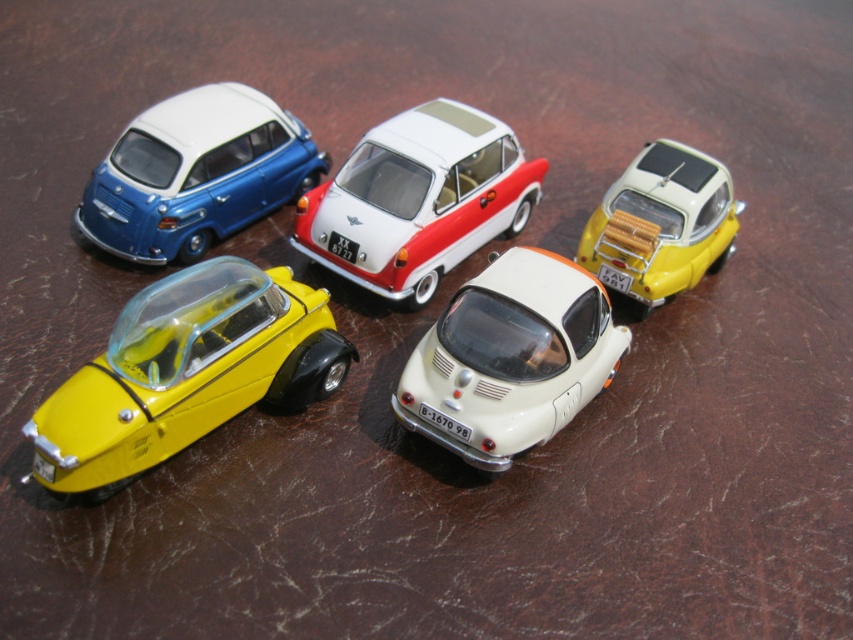
Is the position of matte blue car at upper left more distant than that of yellow matte toy car at upper right?

No, matte blue car at upper left is closer to the viewer.

Does matte blue car at upper left have a greater width compared to yellow matte toy car at upper right?

Indeed, matte blue car at upper left has a greater width compared to yellow matte toy car at upper right.

Which is in front, point (229, 92) or point (666, 173)?

Point (666, 173) is more forward.

At what (x,y) coordinates should I click in order to perform the action: click on matte blue car at upper left. Please return your answer as a coordinate pair (x, y). This screenshot has height=640, width=853. Looking at the image, I should click on (196, 173).

Can you confirm if white matte car at center is positioned to the left of matte blue car at upper left?

Incorrect, white matte car at center is not on the left side of matte blue car at upper left.

How far apart are white matte car at center and matte blue car at upper left?

They are 19.80 inches apart.

Locate an element on the screen. The height and width of the screenshot is (640, 853). white matte car at center is located at coordinates (509, 358).

At what (x,y) coordinates should I click in order to perform the action: click on white matte car at center. Please return your answer as a coordinate pair (x, y). The width and height of the screenshot is (853, 640). Looking at the image, I should click on (509, 358).

Who is taller, white matte car at center or yellow matte toy car at upper right?

white matte car at center is taller.

Who is lower down, white matte car at center or yellow matte toy car at upper right?

white matte car at center is lower down.

Between point (558, 300) and point (630, 275), which one is positioned in front?

Point (558, 300)

The height and width of the screenshot is (640, 853). I want to click on white matte car at center, so click(509, 358).